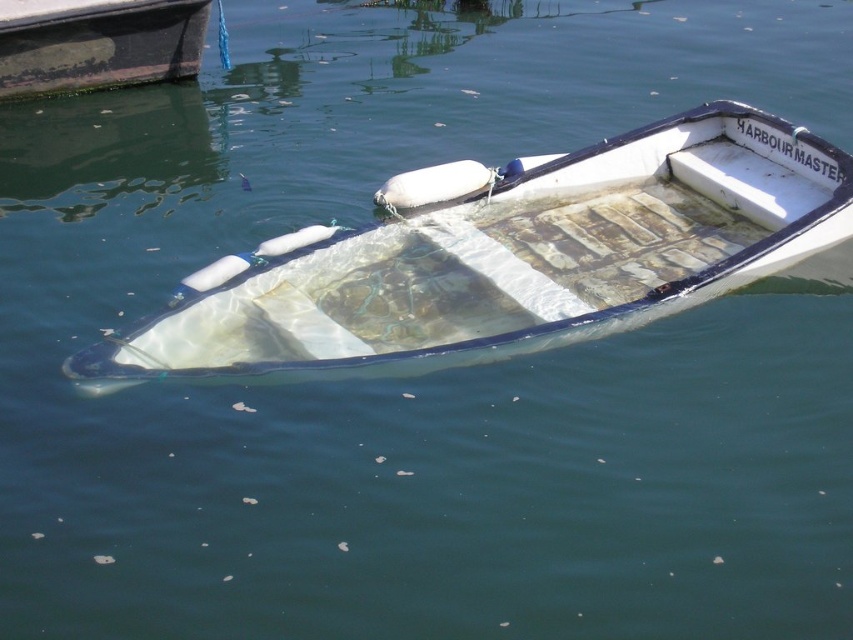
You are standing on the dock and want to place a new buoy at the exact center of the transparent plastic boat at center. According to the coordinates provided, where should you place the buoy?

The buoy should be placed at the coordinates point (x=503, y=259), which is the 2D location of the transparent plastic boat at center.

You are standing on the dock and see the transparent plastic boat at center and the rusty metal boat at upper left. Which boat is closer to the water surface?

The transparent plastic boat at center is positioned under the rusty metal boat at upper left, so it is closer to the water surface.